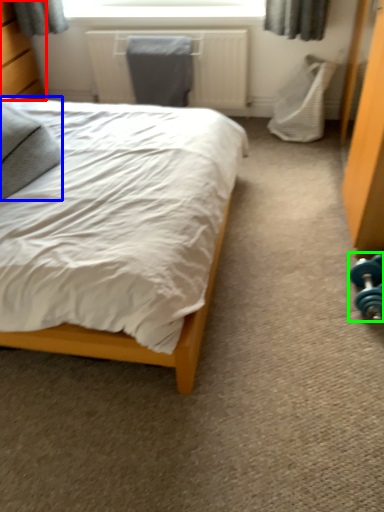
Question: Which object is the closest to the dresser (highlighted by a red box)? Choose among these: pillow (highlighted by a blue box) or dumbbell (highlighted by a green box).

Choices:
 (A) pillow
 (B) dumbbell

Answer: (A)